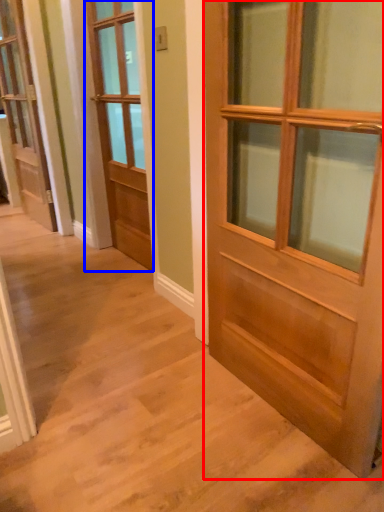
Question: Among these objects, which one is farthest to the camera, door (highlighted by a red box) or door (highlighted by a blue box)?

Choices:
 (A) door
 (B) door

Answer: (B)